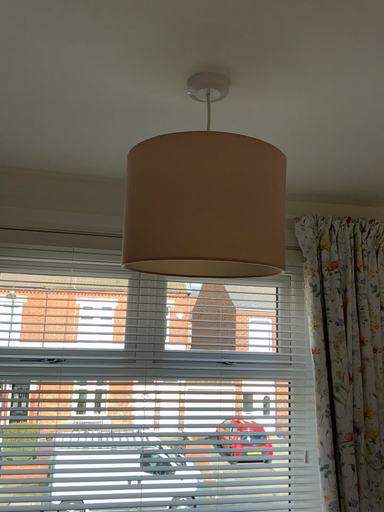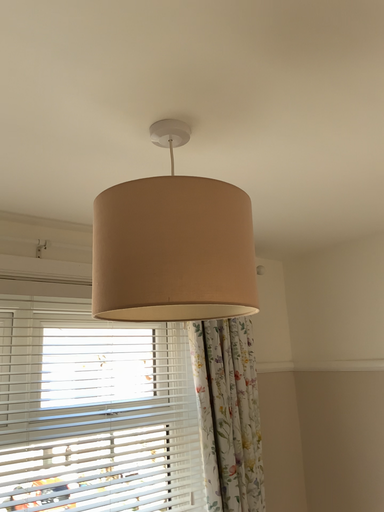
Question: Which way did the camera rotate in the video?

Choices:
 (A) rotated left
 (B) rotated right

Answer: (B)